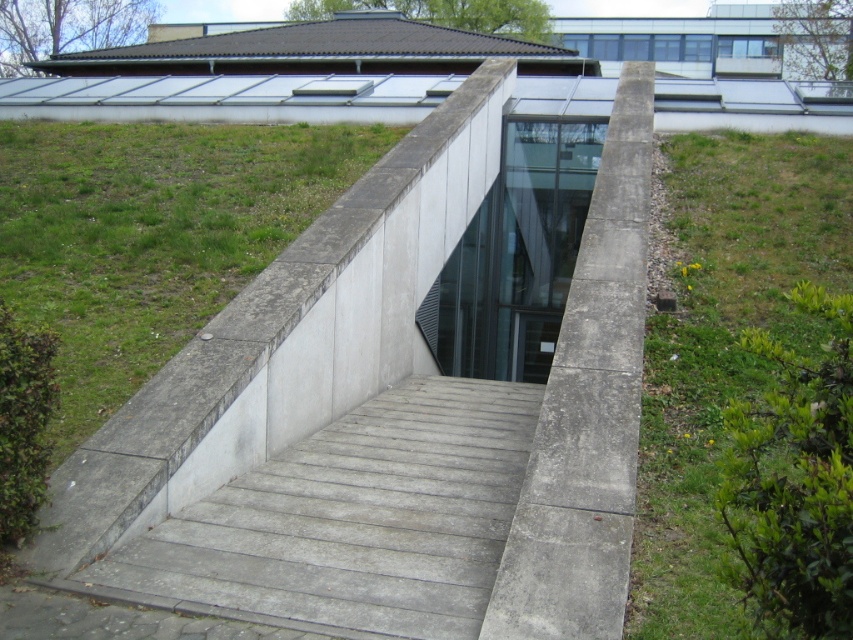
Question: Does concrete stairs at center have a greater width compared to green grass at lower right?

Choices:
 (A) no
 (B) yes

Answer: (A)

Question: Can you confirm if concrete stairs at center is smaller than green grass at lower right?

Choices:
 (A) no
 (B) yes

Answer: (B)

Question: Which point is farther from the camera taking this photo?

Choices:
 (A) (426, 616)
 (B) (704, 397)

Answer: (B)

Question: Where is concrete stairs at center located in relation to green grass at lower right in the image?

Choices:
 (A) above
 (B) below

Answer: (B)

Question: Which object is farther from the camera taking this photo?

Choices:
 (A) green grass at lower right
 (B) concrete stairs at center

Answer: (B)